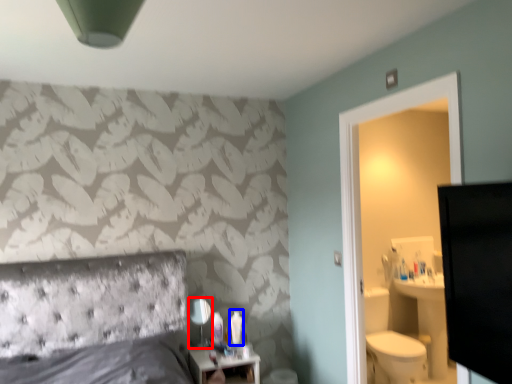
Question: Which object is further to the camera taking this photo, mirror (highlighted by a red box) or toiletry (highlighted by a blue box)?

Choices:
 (A) mirror
 (B) toiletry

Answer: (B)